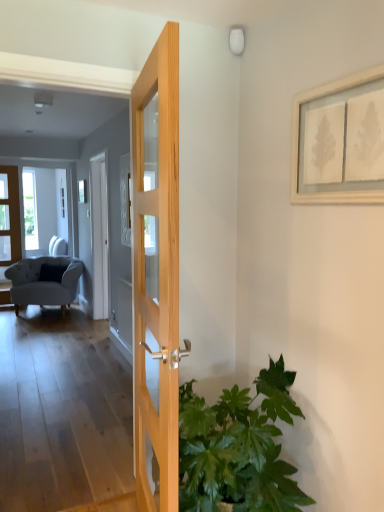
Question: Can you confirm if matte wooden door at left, which is the second door in front-to-back order, is taller than white wooden picture frame at upper right?

Choices:
 (A) yes
 (B) no

Answer: (A)

Question: Considering the relative sizes of matte wooden door at left, the first door in the left-to-right sequence, and white wooden picture frame at upper right in the image provided, is matte wooden door at left, the first door in the left-to-right sequence, bigger than white wooden picture frame at upper right?

Choices:
 (A) yes
 (B) no

Answer: (A)

Question: From the image's perspective, is matte wooden door at left, the 1th door when ordered from back to front, located above white wooden picture frame at upper right?

Choices:
 (A) yes
 (B) no

Answer: (B)

Question: Is matte wooden door at left, the 1th door when ordered from back to front, turned away from white wooden picture frame at upper right?

Choices:
 (A) no
 (B) yes

Answer: (A)

Question: Does matte wooden door at left, the 1th door when ordered from back to front, come behind white wooden picture frame at upper right?

Choices:
 (A) yes
 (B) no

Answer: (A)

Question: From a real-world perspective, is white wooden picture frame at upper right above or below light gray fabric armchair at left?

Choices:
 (A) below
 (B) above

Answer: (B)

Question: Is white wooden picture frame at upper right wider or thinner than light gray fabric armchair at left?

Choices:
 (A) wide
 (B) thin

Answer: (B)

Question: Considering the positions of white wooden picture frame at upper right and light gray fabric armchair at left in the image, is white wooden picture frame at upper right bigger or smaller than light gray fabric armchair at left?

Choices:
 (A) big
 (B) small

Answer: (B)

Question: From the image's perspective, is white wooden picture frame at upper right positioned above or below light gray fabric armchair at left?

Choices:
 (A) below
 (B) above

Answer: (B)

Question: Is matte wooden door at left, which is the second door in right-to-left order, taller or shorter than natural wood door at center, arranged as the 2th door when viewed from the left?

Choices:
 (A) short
 (B) tall

Answer: (B)

Question: Is matte wooden door at left, the 1th door when ordered from back to front, to the left or to the right of natural wood door at center, the first door when ordered from right to left, in the image?

Choices:
 (A) left
 (B) right

Answer: (A)

Question: From a real-world perspective, is matte wooden door at left, the 1th door when ordered from back to front, physically located above or below natural wood door at center, marked as the second door in a back-to-front arrangement?

Choices:
 (A) below
 (B) above

Answer: (B)

Question: From the image's perspective, is matte wooden door at left, the first door in the left-to-right sequence, located above or below natural wood door at center, arranged as the 2th door when viewed from the left?

Choices:
 (A) below
 (B) above

Answer: (B)

Question: Is point (380, 105) closer or farther from the camera than point (9, 210)?

Choices:
 (A) farther
 (B) closer

Answer: (B)

Question: From the image's perspective, is white wooden picture frame at upper right positioned above or below matte wooden door at left, which is the second door in front-to-back order?

Choices:
 (A) above
 (B) below

Answer: (A)